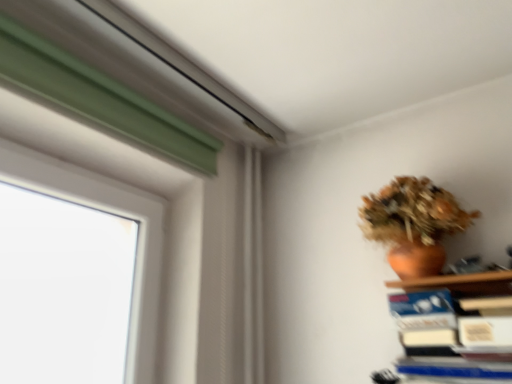
Question: Should I look upward or downward to see terracotta clay vase at upper right?

Choices:
 (A) down
 (B) up

Answer: (A)

Question: Is blue hardcover book at lower right surrounded by terracotta clay vase at upper right?

Choices:
 (A) yes
 (B) no

Answer: (B)

Question: Is terracotta clay vase at upper right looking in the opposite direction of blue hardcover book at lower right?

Choices:
 (A) yes
 (B) no

Answer: (B)

Question: From a real-world perspective, is terracotta clay vase at upper right below blue hardcover book at lower right?

Choices:
 (A) no
 (B) yes

Answer: (A)

Question: Is terracotta clay vase at upper right located outside blue hardcover book at lower right?

Choices:
 (A) no
 (B) yes

Answer: (B)

Question: Can you confirm if terracotta clay vase at upper right is shorter than blue hardcover book at lower right?

Choices:
 (A) yes
 (B) no

Answer: (B)

Question: From the image's perspective, does terracotta clay vase at upper right appear lower than blue hardcover book at lower right?

Choices:
 (A) no
 (B) yes

Answer: (A)

Question: Is blue hardcover book at lower right smaller than terracotta clay vase at upper right?

Choices:
 (A) yes
 (B) no

Answer: (A)

Question: Is blue hardcover book at lower right in contact with terracotta clay vase at upper right?

Choices:
 (A) yes
 (B) no

Answer: (B)

Question: Is blue hardcover book at lower right completely or partially outside of terracotta clay vase at upper right?

Choices:
 (A) no
 (B) yes

Answer: (B)

Question: Are blue hardcover book at lower right and terracotta clay vase at upper right far apart?

Choices:
 (A) no
 (B) yes

Answer: (A)

Question: Can you confirm if blue hardcover book at lower right is wider than terracotta clay vase at upper right?

Choices:
 (A) no
 (B) yes

Answer: (A)

Question: Does blue hardcover book at lower right turn towards terracotta clay vase at upper right?

Choices:
 (A) no
 (B) yes

Answer: (A)

Question: Based on their sizes in the image, would you say terracotta clay vase at upper right is bigger or smaller than blue hardcover book at lower right?

Choices:
 (A) small
 (B) big

Answer: (B)